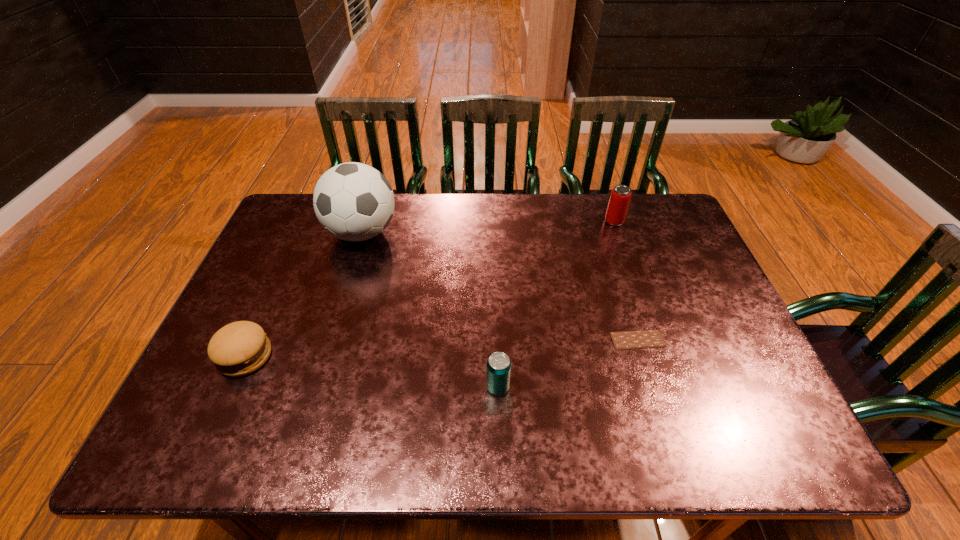
This screenshot has height=540, width=960. Find the location of `soccer ball`. soccer ball is located at coordinates (353, 201).

At what (x,y) coordinates should I click in order to perform the action: click on the second object from left to right. Please return your answer as a coordinate pair (x, y). This screenshot has height=540, width=960. Looking at the image, I should click on (353, 201).

The image size is (960, 540). Find the location of `the second tallest object`. the second tallest object is located at coordinates (620, 197).

Where is `the farther beer can`? The image size is (960, 540). the farther beer can is located at coordinates (620, 197).

Find the location of a particular element. The image size is (960, 540). the nearer beer can is located at coordinates click(498, 371).

Locate an element on the screen. This screenshot has width=960, height=540. the shorter beer can is located at coordinates [498, 371].

Locate an element on the screen. hamburger is located at coordinates (240, 348).

The image size is (960, 540). Identify the location of the fourth tallest object. 240,348.

Where is `the shortest object`? This screenshot has width=960, height=540. the shortest object is located at coordinates (640, 339).

The image size is (960, 540). What are the coordinates of `vacant area situated 0.190m on the front of the tallest object` in the screenshot? It's located at (341, 305).